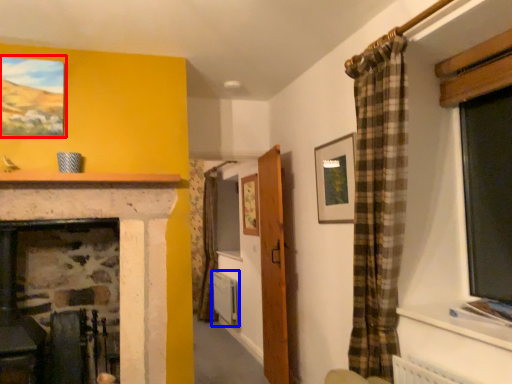
Question: Which point is further to the camera, picture frame (highlighted by a red box) or radiator (highlighted by a blue box)?

Choices:
 (A) picture frame
 (B) radiator

Answer: (B)